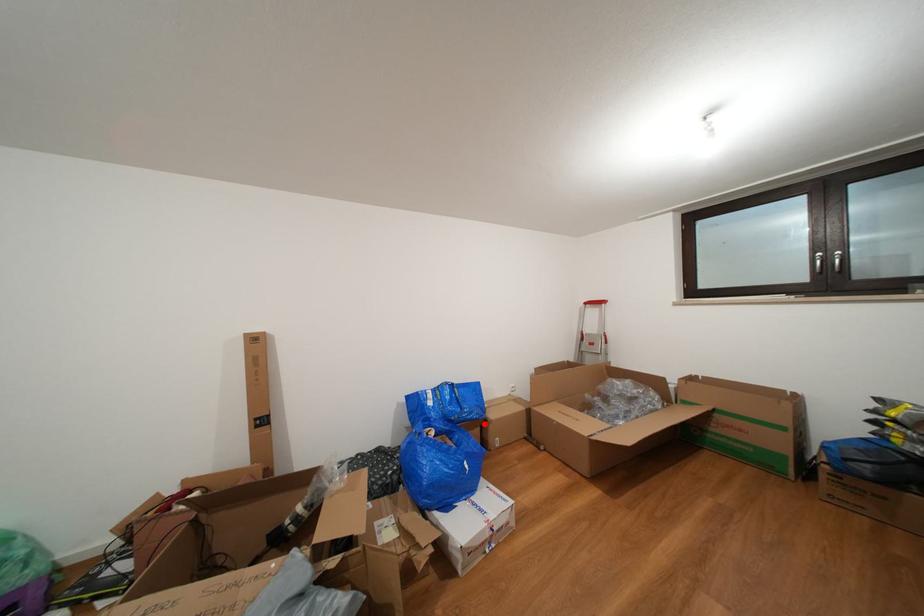
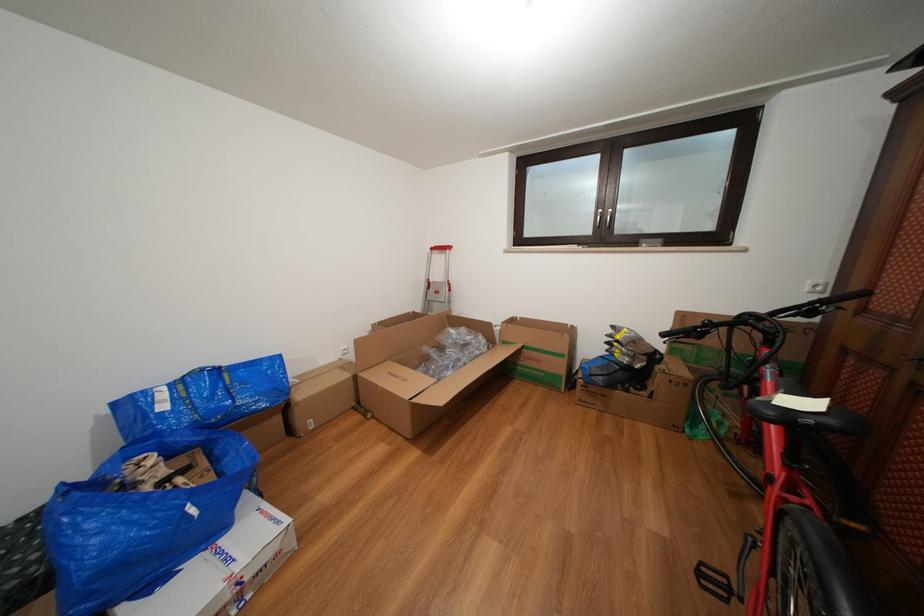
Question: I am providing you with two images of the same scene from different viewpoints. Given a red point in image1, look at the same physical point in image2. Is it:

Choices:
 (A) Closer to the viewpoint
 (B) Farther from the viewpoint

Answer: (A)